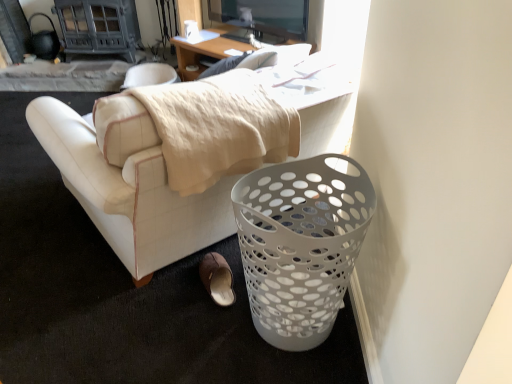
This screenshot has width=512, height=384. I want to click on free space to the left of white perforated trash bin at lower right, so (184, 325).